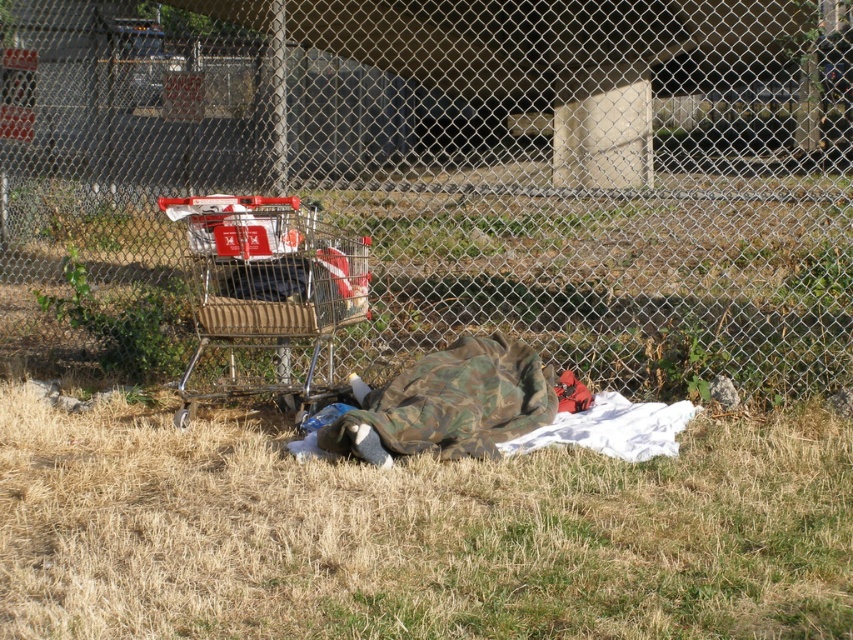
Between point (267, 192) and point (258, 198), which one is positioned behind?

Positioned behind is point (267, 192).

Can you confirm if metallic chain-link fence at center is smaller than metallic silver shopping cart at upper left?

No.

Who is more forward, (840, 257) or (228, 284)?

Point (228, 284) is in front.

This screenshot has height=640, width=853. What are the coordinates of `metallic chain-link fence at center` in the screenshot? It's located at (444, 182).

Who is higher up, metallic chain-link fence at center or green grass at lower center?

metallic chain-link fence at center is above.

This screenshot has width=853, height=640. I want to click on metallic chain-link fence at center, so 444,182.

Which is more to the right, green grass at lower center or metallic silver shopping cart at upper left?

Positioned to the right is green grass at lower center.

Does green grass at lower center have a lesser height compared to metallic silver shopping cart at upper left?

Correct, green grass at lower center is not as tall as metallic silver shopping cart at upper left.

Between point (102, 500) and point (347, 301), which one is positioned behind?

Point (347, 301)

What are the coordinates of `green grass at lower center` in the screenshot? It's located at (416, 532).